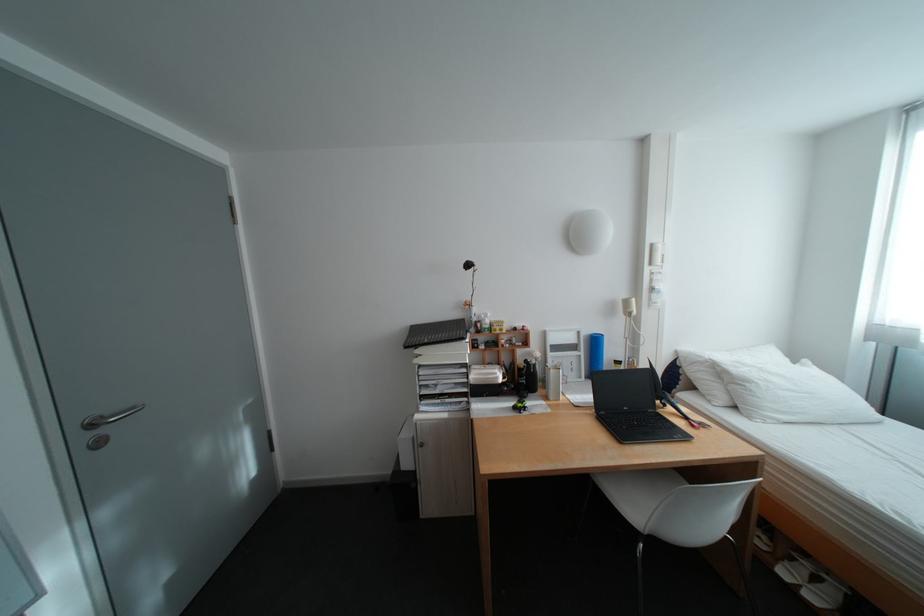
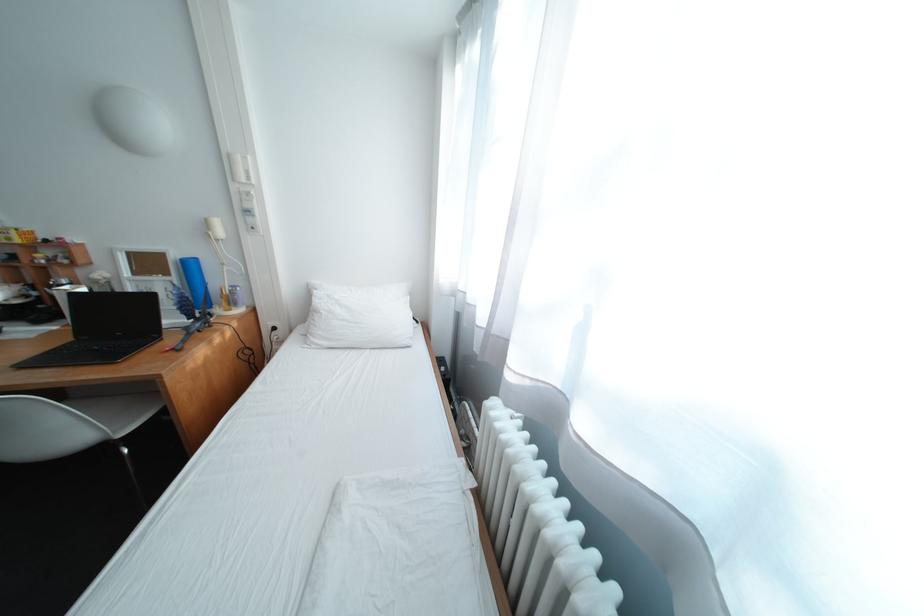
Question: In a continuous first-person perspective shot, in which direction is the camera moving?

Choices:
 (A) Left
 (B) Right
 (C) Forward
 (D) Backward

Answer: (B)